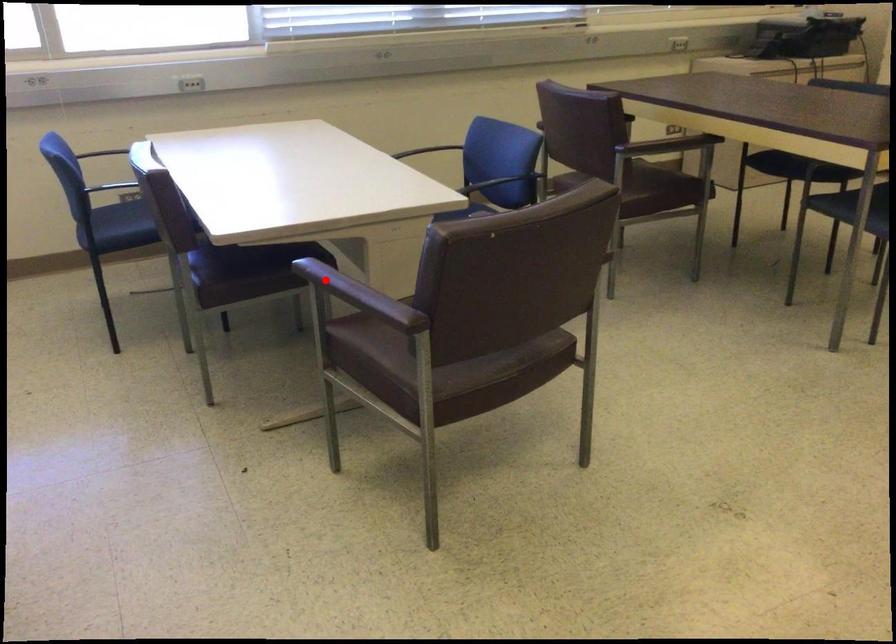
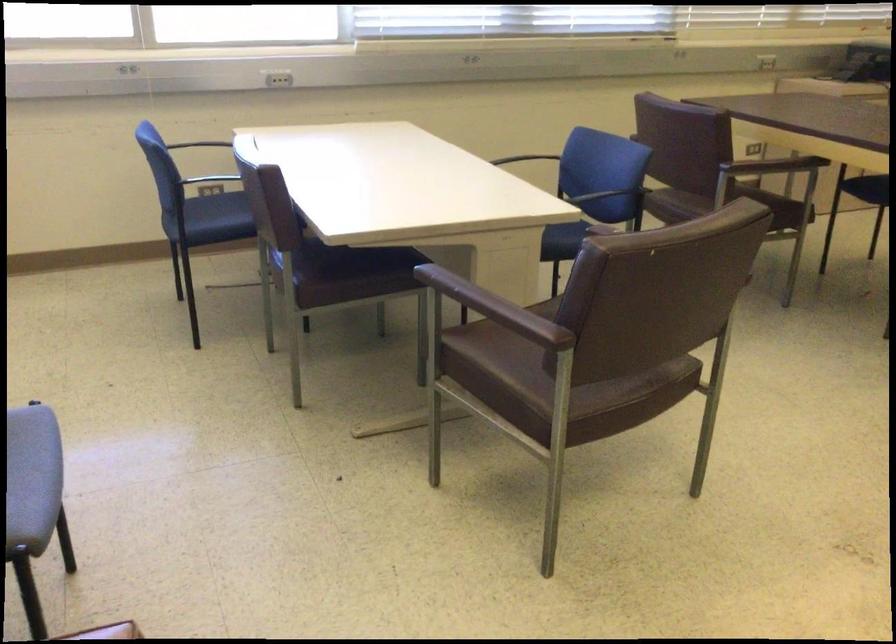
Find the pixel in the second image that matches the highlighted location in the first image.

(453, 287)